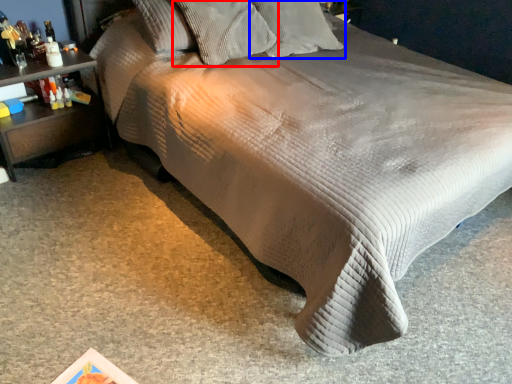
Question: Which of the following is the farthest to the observer, pillow (highlighted by a red box) or pillow (highlighted by a blue box)?

Choices:
 (A) pillow
 (B) pillow

Answer: (B)